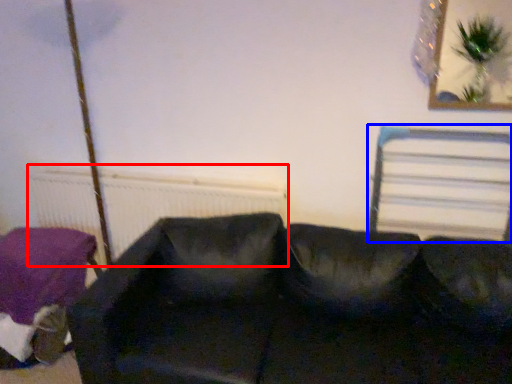
Question: Which object is closer to the camera taking this photo, radiator (highlighted by a red box) or bed frame (highlighted by a blue box)?

Choices:
 (A) radiator
 (B) bed frame

Answer: (B)